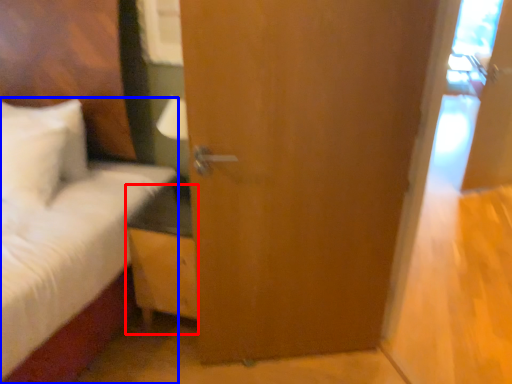
Question: Among these objects, which one is farthest to the camera, nightstand (highlighted by a red box) or bed (highlighted by a blue box)?

Choices:
 (A) nightstand
 (B) bed

Answer: (A)